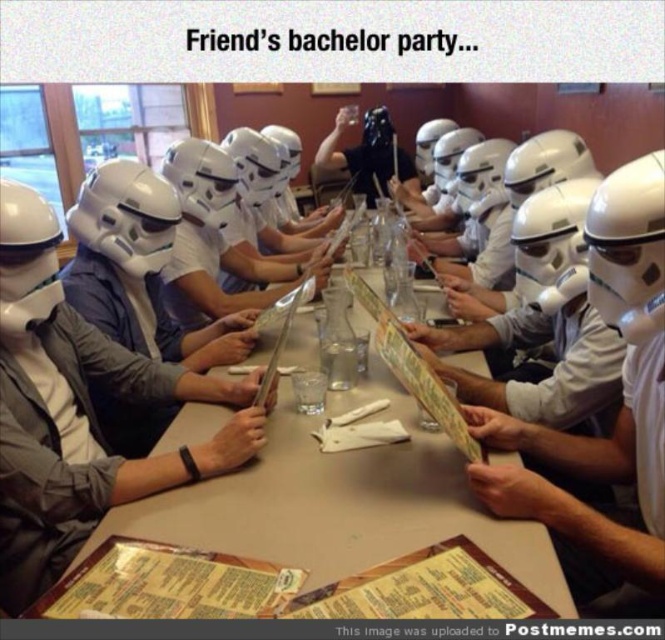
What object is located at the coordinate point (x=340, y=502) in the image?

The point (x=340, y=502) corresponds to the white plastic table at center.

You are taking a photo of the scene and want to focus on both point (21,403) and point (386,109). Which point should you adjust your focus to first to ensure both are in focus?

You should focus on point (386,109) first because it is farther from the camera than point (21,403), ensuring both points will be in focus when focusing on the farther one.